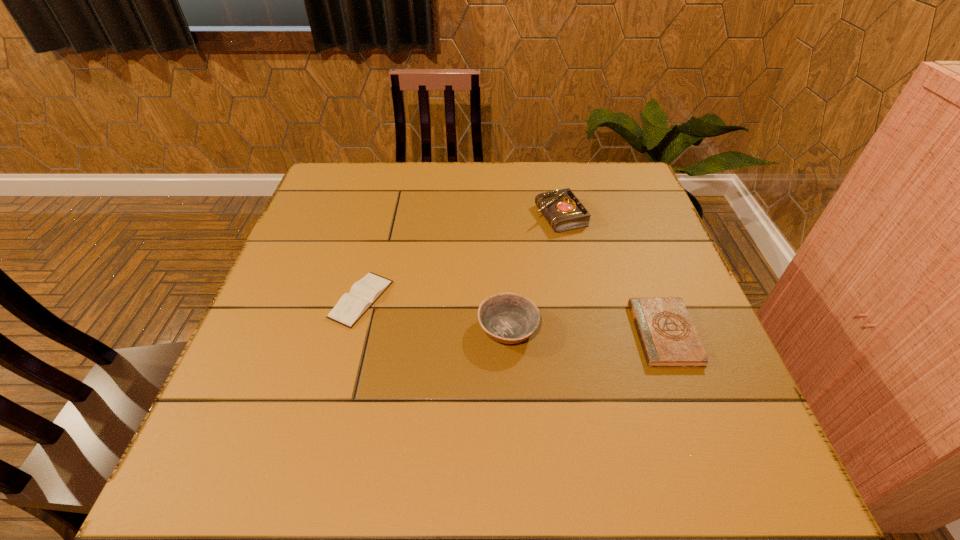
This screenshot has height=540, width=960. What are the coordinates of `vacant space at the near right corner of the desktop` in the screenshot? It's located at (760, 455).

You are a GUI agent. You are given a task and a screenshot of the screen. Output one action in this format:
    pyautogui.click(x=<x>, y=<y>)
    Task: Click on the vacant region between the third object from right to left and the tallest diary
    
    Given the screenshot: What is the action you would take?
    pyautogui.click(x=534, y=272)

You are a GUI agent. You are given a task and a screenshot of the screen. Output one action in this format:
    pyautogui.click(x=<x>, y=<y>)
    Task: Click on the free space that is in between the third object from right to left and the second object from right to left
    
    Given the screenshot: What is the action you would take?
    pyautogui.click(x=534, y=272)

Find the location of `vacant region between the second diary from right to left and the leftmost object`. vacant region between the second diary from right to left and the leftmost object is located at coordinates (461, 258).

The width and height of the screenshot is (960, 540). I want to click on vacant space that is in between the second diary from right to left and the leftmost diary, so click(x=461, y=258).

Identify the location of unoccupied area between the leftmost diary and the tallest diary. Image resolution: width=960 pixels, height=540 pixels. (461, 258).

Where is `vacant area between the bowl and the rightmost object`? The height and width of the screenshot is (540, 960). vacant area between the bowl and the rightmost object is located at coordinates coord(587,331).

Image resolution: width=960 pixels, height=540 pixels. I want to click on vacant region between the second object from right to left and the leftmost diary, so tap(461, 258).

Locate which object is the second closest to the bowl. Please provide its 2D coordinates. Your answer should be formatted as a tuple, i.e. [(x, y)], where the tuple contains the x and y coordinates of a point satisfying the conditions above.

[(668, 337)]

The width and height of the screenshot is (960, 540). In order to click on object that is the second closest one to the rightmost diary in this screenshot , I will do `click(562, 209)`.